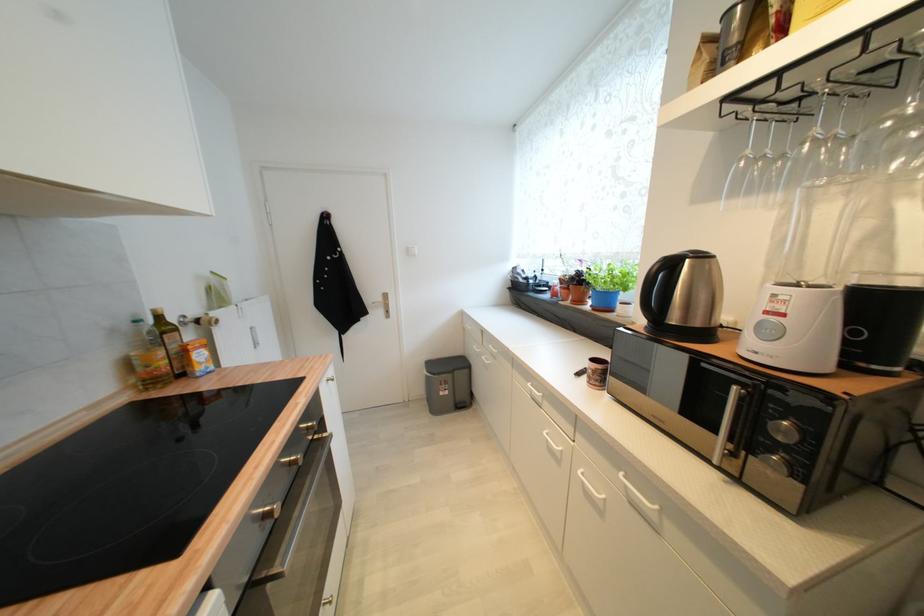
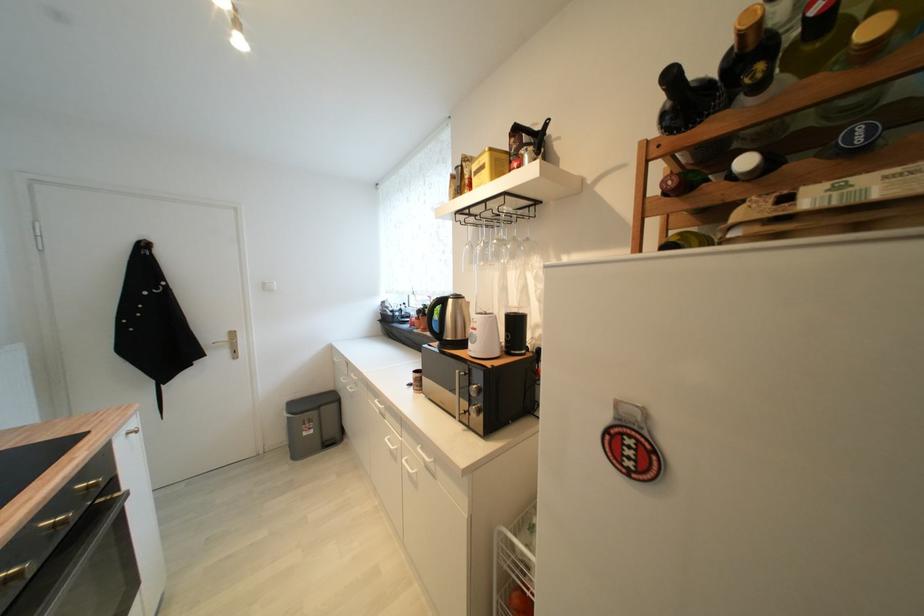
Find the pixel in the second image that matches the point at 322,439 in the first image.

(107, 503)